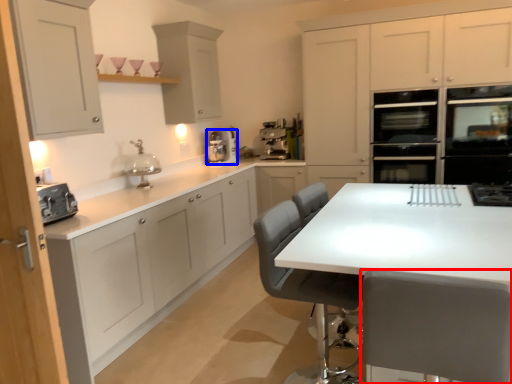
Question: Among these objects, which one is nearest to the camera, chair (highlighted by a red box) or kitchen appliance (highlighted by a blue box)?

Choices:
 (A) chair
 (B) kitchen appliance

Answer: (A)